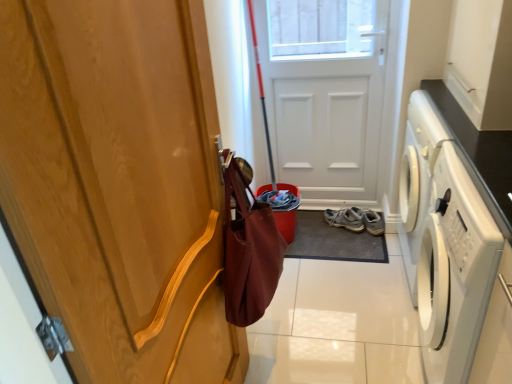
You are a GUI agent. You are given a task and a screenshot of the screen. Output one action in this format:
    pyautogui.click(x=<x>, y=<y>)
    Task: Click on the vacant region below dark gray rubber doormat at center (from a real-world perspective)
    The image size is (512, 384).
    Given the screenshot: What is the action you would take?
    pyautogui.click(x=336, y=235)